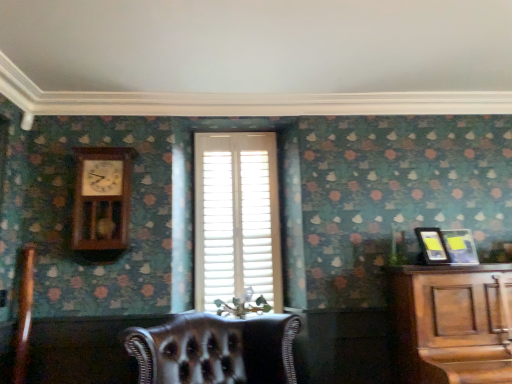
Identify the location of blank space situated above wooden pendulum clock at upper left (from a real-world perspective). (106, 150).